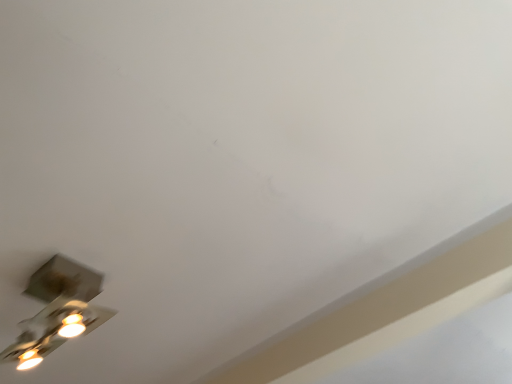
Image resolution: width=512 pixels, height=384 pixels. Describe the element at coordinates (58, 310) in the screenshot. I see `metallic gold ceiling fan at lower left` at that location.

I want to click on metallic gold ceiling fan at lower left, so click(58, 310).

Measure the distance between metallic gold ceiling fan at lower left and camera.

metallic gold ceiling fan at lower left and camera are 3.30 feet apart from each other.

Find the location of a particular element. This screenshot has width=512, height=384. metallic gold ceiling fan at lower left is located at coordinates (58, 310).